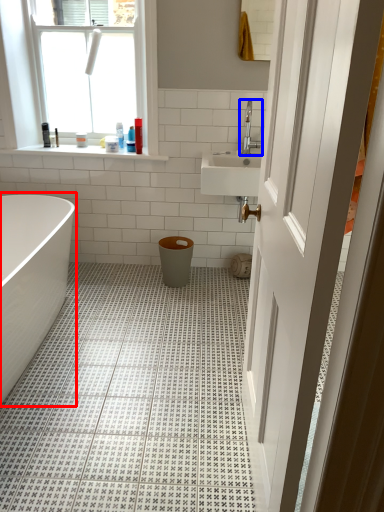
Question: Among these objects, which one is farthest to the camera, bathtub (highlighted by a red box) or tap (highlighted by a blue box)?

Choices:
 (A) bathtub
 (B) tap

Answer: (B)